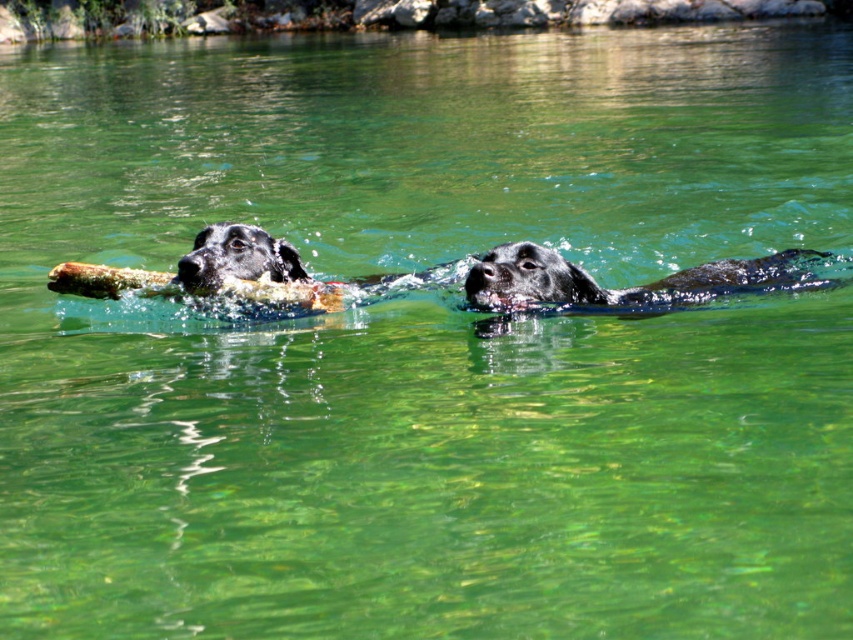
You are a photographer trying to capture both the shiny black fur at center and the black glossy dog at left in a single frame. Which one should you focus on first to ensure they are both in the shot?

The shiny black fur at center is positioned on the right side of the black glossy dog at left, so you should focus on the black glossy dog at left first to ensure both are in the frame.

You are a photographer trying to capture the reflection of the shiny black fur at center and the black glossy dog at left in the water. Which object will have a clearer reflection?

The black glossy dog at left has a smoother surface compared to the shiny black fur at center, so its reflection will be clearer.